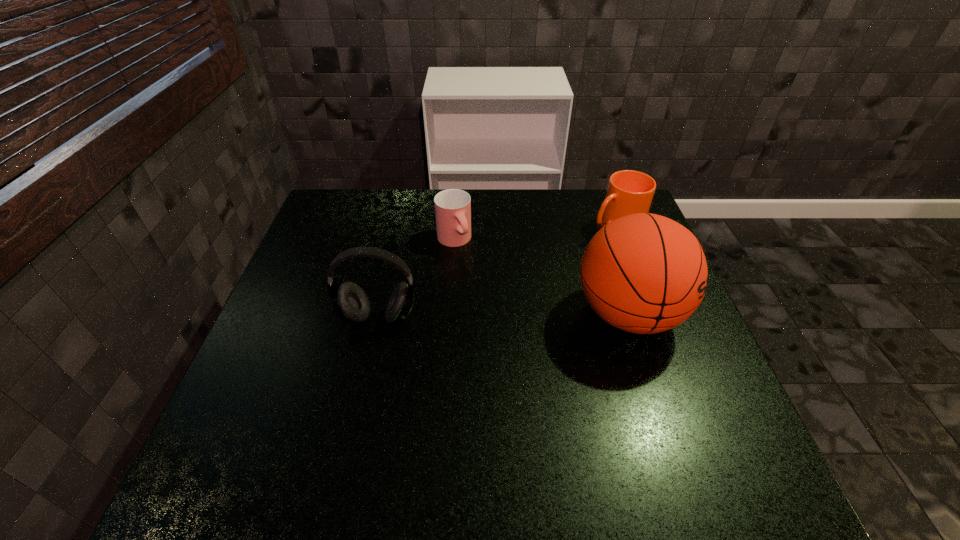
I want to click on the second tallest object, so click(350, 303).

This screenshot has height=540, width=960. Find the location of `the leftmost object`. the leftmost object is located at coordinates (350, 303).

Image resolution: width=960 pixels, height=540 pixels. I want to click on basketball, so click(x=643, y=273).

I want to click on the third object from right to left, so click(x=452, y=206).

Locate an element on the screen. the shortest object is located at coordinates (452, 206).

The height and width of the screenshot is (540, 960). In order to click on the second shortest object in this screenshot , I will do `click(629, 192)`.

Locate an element on the screen. vacant area located on the ear cups of the second tallest object is located at coordinates (354, 427).

The image size is (960, 540). Find the location of `free space located on the side of the second object from left to right with the handle`. free space located on the side of the second object from left to right with the handle is located at coordinates (501, 319).

The height and width of the screenshot is (540, 960). In order to click on vacant space situated 0.080m on the side of the second object from left to right with the handle in this screenshot , I will do `click(471, 272)`.

The width and height of the screenshot is (960, 540). What are the coordinates of `vacant space positioned on the side of the second object from left to right with the handle` in the screenshot? It's located at (496, 311).